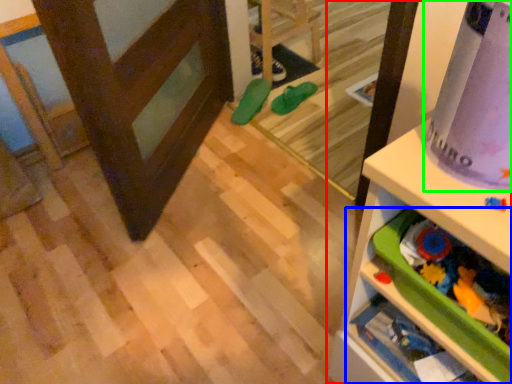
Question: Which is farther away from shelf (highlighted by a red box)? shelf (highlighted by a blue box) or wrapping paper (highlighted by a green box)?

Choices:
 (A) shelf
 (B) wrapping paper

Answer: (B)